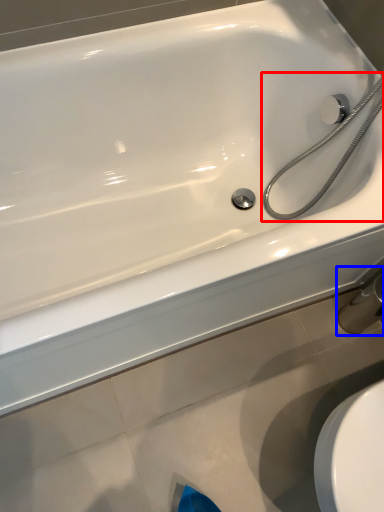
Question: Which point is further to the camera, shower (highlighted by a red box) or faucet (highlighted by a blue box)?

Choices:
 (A) shower
 (B) faucet

Answer: (B)